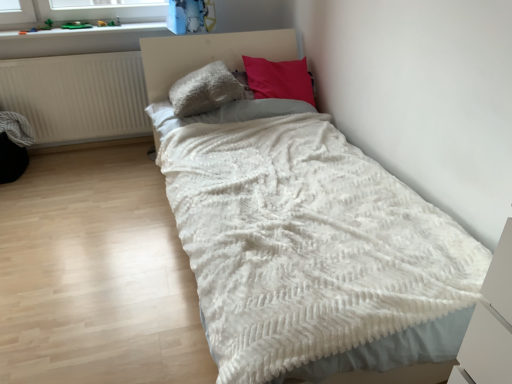
Question: Looking at the image, does velvet-like pink pillow at upper center, which ranks as the first pillow in right-to-left order, seem bigger or smaller compared to fluffy gray pillow at center, the first pillow from the left?

Choices:
 (A) big
 (B) small

Answer: (A)

Question: Considering the positions of velvet-like pink pillow at upper center, the 2th pillow positioned from the left, and fluffy gray pillow at center, the first pillow from the left, in the image, is velvet-like pink pillow at upper center, the 2th pillow positioned from the left, taller or shorter than fluffy gray pillow at center, the first pillow from the left,?

Choices:
 (A) short
 (B) tall

Answer: (B)

Question: Which object is positioned closest to the fluffy gray pillow at center, positioned as the second pillow in right-to-left order?

Choices:
 (A) velvet-like pink pillow at upper center, which ranks as the first pillow in right-to-left order
 (B) smooth plastic toys at upper left
 (C) white fluffy blanket at center
 (D) white matte radiator at left

Answer: (A)

Question: Estimate the real-world distances between objects in this image. Which object is farther from the velvet-like pink pillow at upper center, the 2th pillow positioned from the left?

Choices:
 (A) white matte radiator at left
 (B) smooth plastic toys at upper left
 (C) white fluffy blanket at center
 (D) fluffy gray pillow at center, positioned as the second pillow in right-to-left order

Answer: (A)